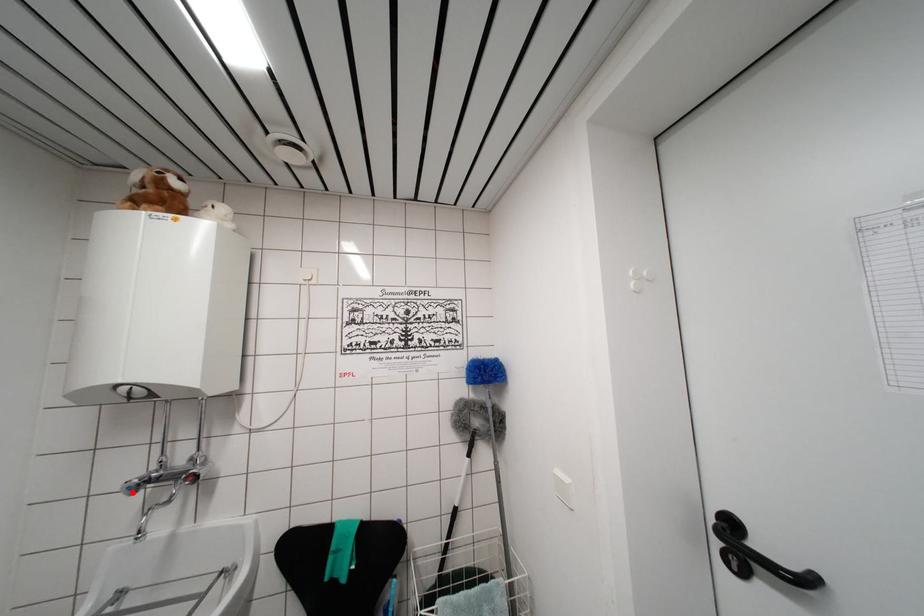
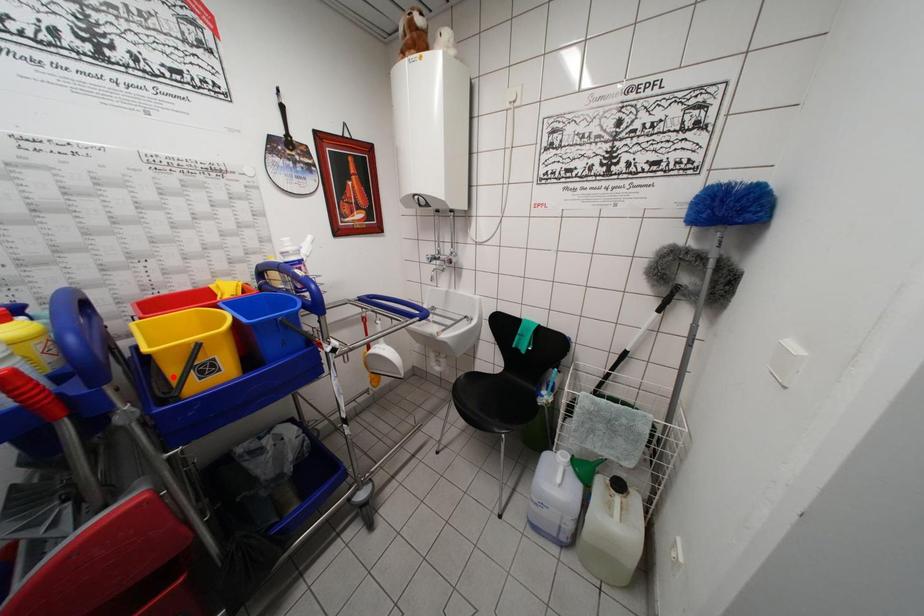
I am providing you with two images of the same scene from different viewpoints. A red point is marked on the first image and another point is marked on the second image. Are the points marked in image1 and image2 representing the same 3D position?

No